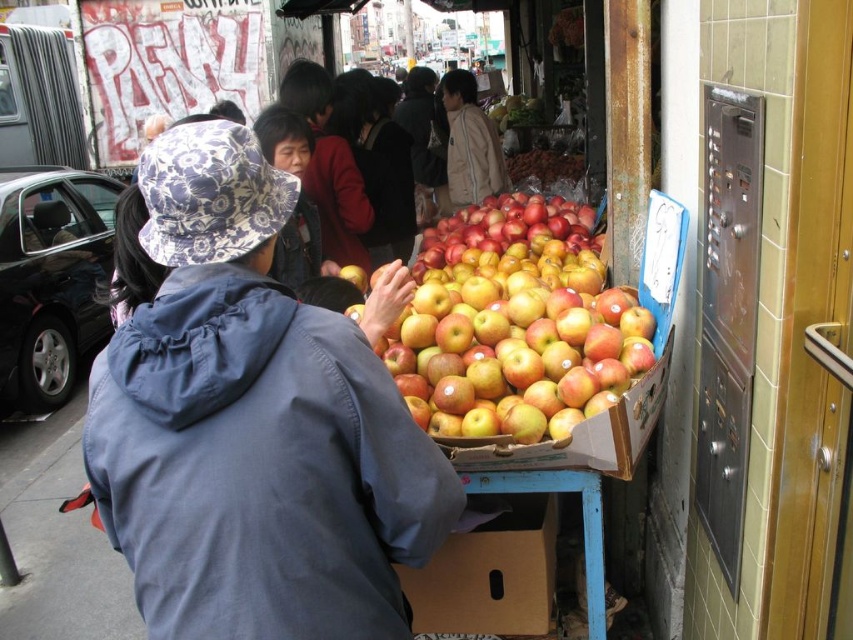
Question: Which point is farther to the camera?

Choices:
 (A) (373, 240)
 (B) (606, 388)

Answer: (A)

Question: Can you confirm if glossy red apples at center is positioned above brown cardboard box at lower center?

Choices:
 (A) yes
 (B) no

Answer: (A)

Question: Estimate the real-world distances between objects in this image. Which object is farther from the glossy red apples at center?

Choices:
 (A) brown cardboard box at lower center
 (B) matte black jacket at center
 (C) light brown jacket at center

Answer: (C)

Question: Which object is the farthest from the matte black jacket at center?

Choices:
 (A) glossy red apples at center
 (B) light brown jacket at center

Answer: (A)

Question: In this image, where is matte black jacket at center located relative to light brown jacket at center?

Choices:
 (A) below
 (B) above

Answer: (A)

Question: Can you confirm if brown cardboard box at lower center is wider than matte black jacket at center?

Choices:
 (A) no
 (B) yes

Answer: (B)